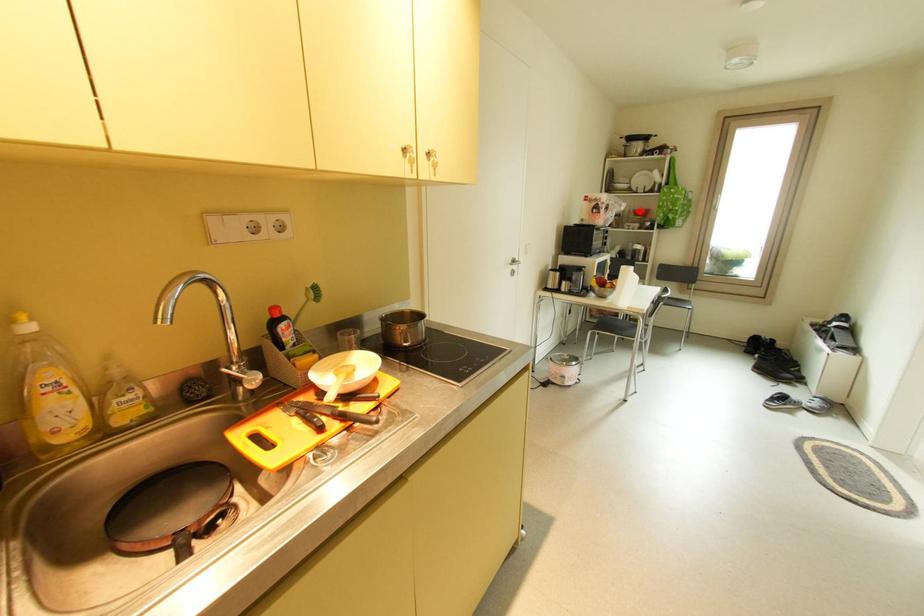
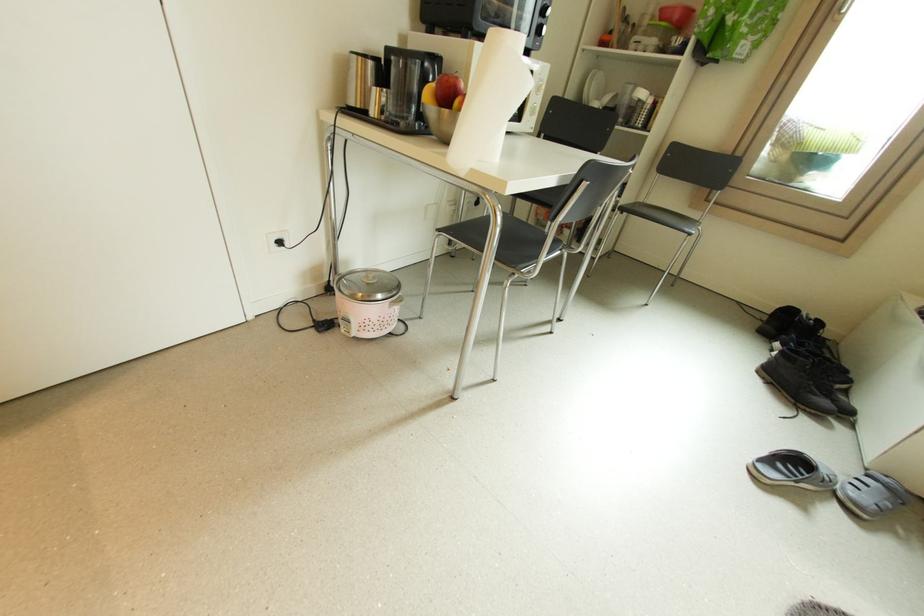
Question: I am providing you with two images of the same scene from different viewpoints. A red point is marked on the first image. At the location where the point appears in image 1, is it still visible in image 2?

Choices:
 (A) Yes
 (B) No

Answer: (A)